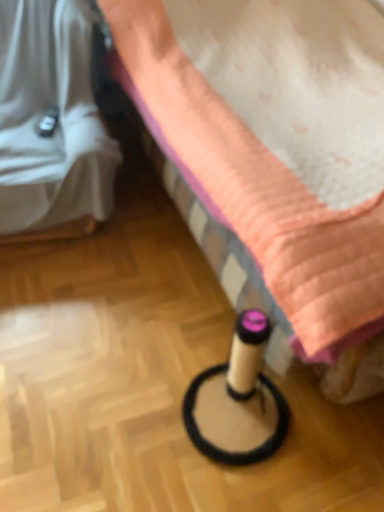
Find the location of a particular element. The width and height of the screenshot is (384, 512). white fabric at left, the 2th furniture viewed from the right is located at coordinates (58, 119).

What is the approximate height of white fabric at left, the 2th furniture viewed from the right?

white fabric at left, the 2th furniture viewed from the right, is 36.83 inches in height.

What do you see at coordinates (58, 119) in the screenshot? Image resolution: width=384 pixels, height=512 pixels. I see `white fabric at left, the first furniture from the left` at bounding box center [58, 119].

This screenshot has height=512, width=384. Describe the element at coordinates (275, 141) in the screenshot. I see `beige cardboard tube at lower center, which appears as the 1th furniture when viewed from the right` at that location.

The image size is (384, 512). I want to click on beige cardboard tube at lower center, which appears as the 1th furniture when viewed from the right, so click(275, 141).

Identify the location of white fabric at left, the 2th furniture viewed from the right. This screenshot has width=384, height=512. (58, 119).

Considering the positions of objects white fabric at left, the first furniture from the left, and beige cardboard tube at lower center, which appears as the 1th furniture when viewed from the right, in the image provided, who is more to the right, white fabric at left, the first furniture from the left, or beige cardboard tube at lower center, which appears as the 1th furniture when viewed from the right,?

From the viewer's perspective, beige cardboard tube at lower center, which appears as the 1th furniture when viewed from the right, appears more on the right side.

Is white fabric at left, the first furniture from the left, further to the viewer compared to beige cardboard tube at lower center, which appears as the 1th furniture when viewed from the right?

That is True.

Is point (23, 206) positioned behind point (224, 161)?

Yes, point (23, 206) is farther from viewer.

Looking at this image, from the image's perspective, is white fabric at left, the 2th furniture viewed from the right, located above beige cardboard tube at lower center, which appears as the 1th furniture when viewed from the right?

Indeed, from the image's perspective, white fabric at left, the 2th furniture viewed from the right, is shown above beige cardboard tube at lower center, which appears as the 1th furniture when viewed from the right.

From a real-world perspective, is white fabric at left, the 2th furniture viewed from the right, beneath beige cardboard tube at lower center, which appears as the 1th furniture when viewed from the right?

Correct, in the physical world, white fabric at left, the 2th furniture viewed from the right, is lower than beige cardboard tube at lower center, which appears as the 1th furniture when viewed from the right.

Can you confirm if white fabric at left, the 2th furniture viewed from the right, is thinner than beige cardboard tube at lower center, which appears as the 1th furniture when viewed from the right?

Yes.

Is white fabric at left, the first furniture from the left, taller or shorter than beige cardboard tube at lower center, positioned as the second furniture in left-to-right order?

In the image, white fabric at left, the first furniture from the left, appears to be shorter than beige cardboard tube at lower center, positioned as the second furniture in left-to-right order.

Can you confirm if white fabric at left, the first furniture from the left, is bigger than beige cardboard tube at lower center, positioned as the second furniture in left-to-right order?

Incorrect, white fabric at left, the first furniture from the left, is not larger than beige cardboard tube at lower center, positioned as the second furniture in left-to-right order.

Is beige cardboard tube at lower center, positioned as the second furniture in left-to-right order, a part of white fabric at left, the 2th furniture viewed from the right?

No.

Is the surface of white fabric at left, the 2th furniture viewed from the right, in direct contact with beige cardboard tube at lower center, which appears as the 1th furniture when viewed from the right?

No, white fabric at left, the 2th furniture viewed from the right, is not next to beige cardboard tube at lower center, which appears as the 1th furniture when viewed from the right.

Is white fabric at left, the 2th furniture viewed from the right, facing away from beige cardboard tube at lower center, positioned as the second furniture in left-to-right order?

white fabric at left, the 2th furniture viewed from the right, does not have its back to beige cardboard tube at lower center, positioned as the second furniture in left-to-right order.

Measure the distance from white fabric at left, the first furniture from the left, to beige cardboard tube at lower center, which appears as the 1th furniture when viewed from the right.

white fabric at left, the first furniture from the left, and beige cardboard tube at lower center, which appears as the 1th furniture when viewed from the right, are 58.53 centimeters apart.

This screenshot has height=512, width=384. In order to click on furniture on the right of white fabric at left, the first furniture from the left in this screenshot , I will do `click(275, 141)`.

Which is more to the right, beige cardboard tube at lower center, which appears as the 1th furniture when viewed from the right, or white fabric at left, the 2th furniture viewed from the right?

beige cardboard tube at lower center, which appears as the 1th furniture when viewed from the right.

Is beige cardboard tube at lower center, positioned as the second furniture in left-to-right order, further to the viewer compared to white fabric at left, the first furniture from the left?

That is False.

Is point (274, 30) positioned after point (76, 177)?

Yes, it is behind point (76, 177).

From the image's perspective, which one is positioned lower, beige cardboard tube at lower center, positioned as the second furniture in left-to-right order, or white fabric at left, the first furniture from the left?

From the image's view, beige cardboard tube at lower center, positioned as the second furniture in left-to-right order, is below.

From a real-world perspective, does beige cardboard tube at lower center, which appears as the 1th furniture when viewed from the right, sit lower than white fabric at left, the 2th furniture viewed from the right?

Incorrect, from a real-world perspective, beige cardboard tube at lower center, which appears as the 1th furniture when viewed from the right, is higher than white fabric at left, the 2th furniture viewed from the right.

Is beige cardboard tube at lower center, which appears as the 1th furniture when viewed from the right, wider or thinner than white fabric at left, the 2th furniture viewed from the right?

Considering their sizes, beige cardboard tube at lower center, which appears as the 1th furniture when viewed from the right, looks broader than white fabric at left, the 2th furniture viewed from the right.

Can you confirm if beige cardboard tube at lower center, positioned as the second furniture in left-to-right order, is taller than white fabric at left, the 2th furniture viewed from the right?

Indeed, beige cardboard tube at lower center, positioned as the second furniture in left-to-right order, has a greater height compared to white fabric at left, the 2th furniture viewed from the right.

Is beige cardboard tube at lower center, which appears as the 1th furniture when viewed from the right, bigger than white fabric at left, the 2th furniture viewed from the right?

Indeed, beige cardboard tube at lower center, which appears as the 1th furniture when viewed from the right, has a larger size compared to white fabric at left, the 2th furniture viewed from the right.

Would you say beige cardboard tube at lower center, positioned as the second furniture in left-to-right order, is outside white fabric at left, the 2th furniture viewed from the right?

Yes, beige cardboard tube at lower center, positioned as the second furniture in left-to-right order, is outside of white fabric at left, the 2th furniture viewed from the right.

Is beige cardboard tube at lower center, which appears as the 1th furniture when viewed from the right, positioned far away from white fabric at left, the first furniture from the left?

No, beige cardboard tube at lower center, which appears as the 1th furniture when viewed from the right, is not far away from white fabric at left, the first furniture from the left.

Is beige cardboard tube at lower center, positioned as the second furniture in left-to-right order, aimed at white fabric at left, the first furniture from the left?

Yes, beige cardboard tube at lower center, positioned as the second furniture in left-to-right order, is facing white fabric at left, the first furniture from the left.

Can you tell me how much beige cardboard tube at lower center, which appears as the 1th furniture when viewed from the right, and white fabric at left, the 2th furniture viewed from the right, differ in facing direction?

They differ by 81.6 degrees in their facing directions.

How much distance is there between beige cardboard tube at lower center, positioned as the second furniture in left-to-right order, and white fabric at left, the 2th furniture viewed from the right?

A distance of 23.04 inches exists between beige cardboard tube at lower center, positioned as the second furniture in left-to-right order, and white fabric at left, the 2th furniture viewed from the right.

At what (x,y) coordinates should I click in order to perform the action: click on furniture that is behind the beige cardboard tube at lower center, which appears as the 1th furniture when viewed from the right. Please return your answer as a coordinate pair (x, y). Looking at the image, I should click on point(58,119).

Find the location of a particular element. furniture to the left of beige cardboard tube at lower center, which appears as the 1th furniture when viewed from the right is located at coordinates (58, 119).

The height and width of the screenshot is (512, 384). Identify the location of furniture located in front of the white fabric at left, the 2th furniture viewed from the right. (275, 141).